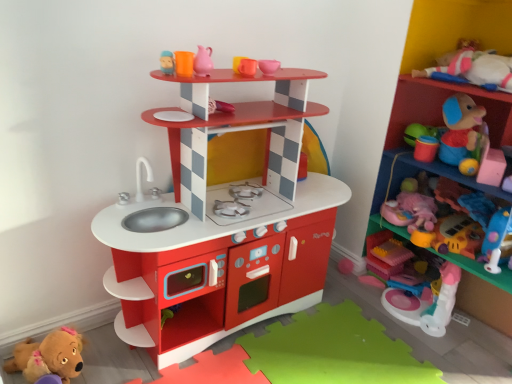
Image resolution: width=512 pixels, height=384 pixels. I want to click on vacant space that is in between pink plastic toy at right, the 2th toy ordered from the bottom, and matte plastic shelf at upper center, marked as the second shelf in a right-to-left arrangement, so click(315, 337).